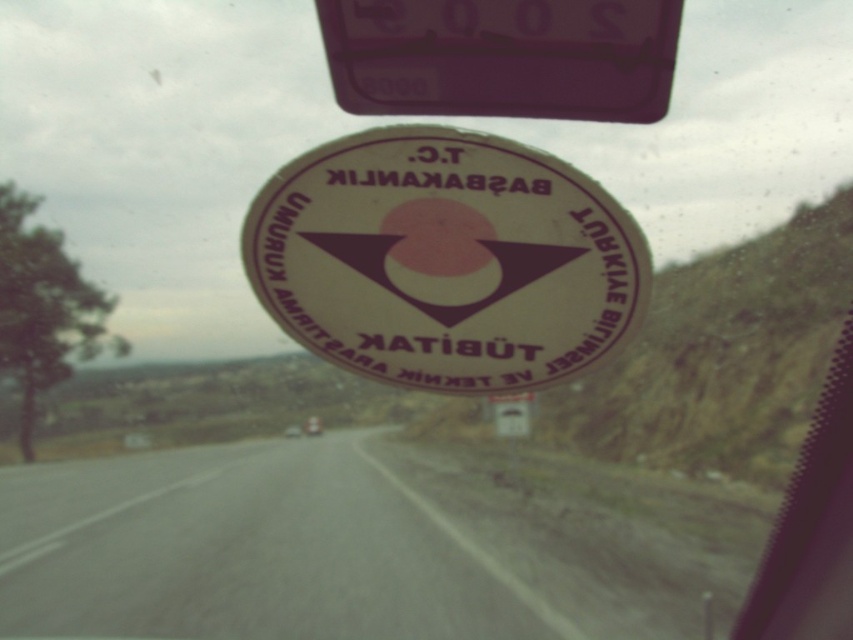
You are a driver who needs to stay within the lanes on the gray asphalt road at center. Can you see the purple glossy traffic sign at upper center from your current position? If yes, is it possible that the road is wide enough to allow safe passage without hitting the sign?

The gray asphalt road at center might be wider than purple glossy traffic sign at upper center, so it is possible that the road is wide enough to allow safe passage without hitting the sign. However, the exact width isn not specified, so caution is advised.

You are a passenger in a car and notice two items through the window. One is the white glossy sticker at center and the other is the purple glossy traffic sign at upper center. Which of these two items appears taller in the view?

The white glossy sticker at center appears taller than the purple glossy traffic sign at upper center because the white glossy sticker at center has a greater height compared to the purple glossy traffic sign at upper center.

You are a passenger in a car and see the point marked at coordinates (248, 550). What does this point represent in the scene?

The point at (248, 550) marks the gray asphalt road at center.